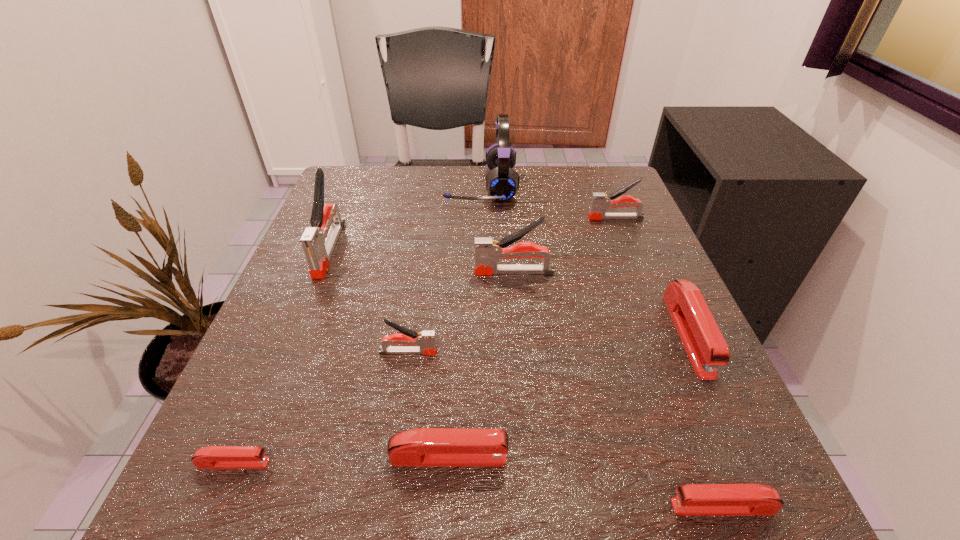
Identify which red stapler is the third closest to the second farthest object. Please provide its 2D coordinates. Your answer should be formatted as a tuple, i.e. [(x, y)], where the tuple contains the x and y coordinates of a point satisfying the conditions above.

[(693, 499)]

Locate an element on the screen. the third closest red stapler to the smallest gray stapler is located at coordinates (693, 499).

The image size is (960, 540). What are the coordinates of `free region that satisfies the following two spatial constraints: 1. on the ear cushions of the farthest object; 2. on the handle side of the biggest gray stapler` in the screenshot? It's located at (481, 249).

Where is `vacant point that satisfies the following two spatial constraints: 1. on the front-facing side of the farthest red stapler; 2. on the front-facing side of the third biggest red stapler`? vacant point that satisfies the following two spatial constraints: 1. on the front-facing side of the farthest red stapler; 2. on the front-facing side of the third biggest red stapler is located at coordinates (766, 507).

Identify the location of vacant area that satisfies the following two spatial constraints: 1. on the front-facing side of the biggest red stapler; 2. on the handle side of the smallest gray stapler. (696, 352).

Identify the location of free space that satisfies the following two spatial constraints: 1. on the front-facing side of the farthest red stapler; 2. on the front-facing side of the nearest red stapler. Image resolution: width=960 pixels, height=540 pixels. (766, 507).